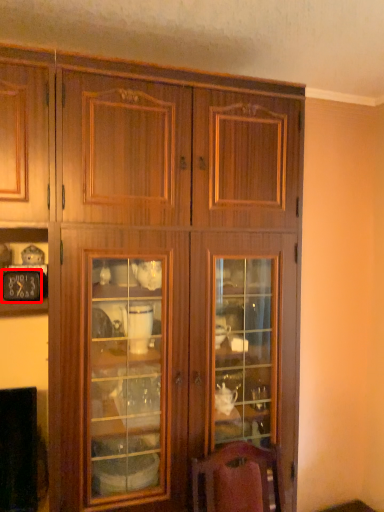
Question: In this image, where is clock (annotated by the red box) located relative to cupboard?

Choices:
 (A) left
 (B) right

Answer: (A)